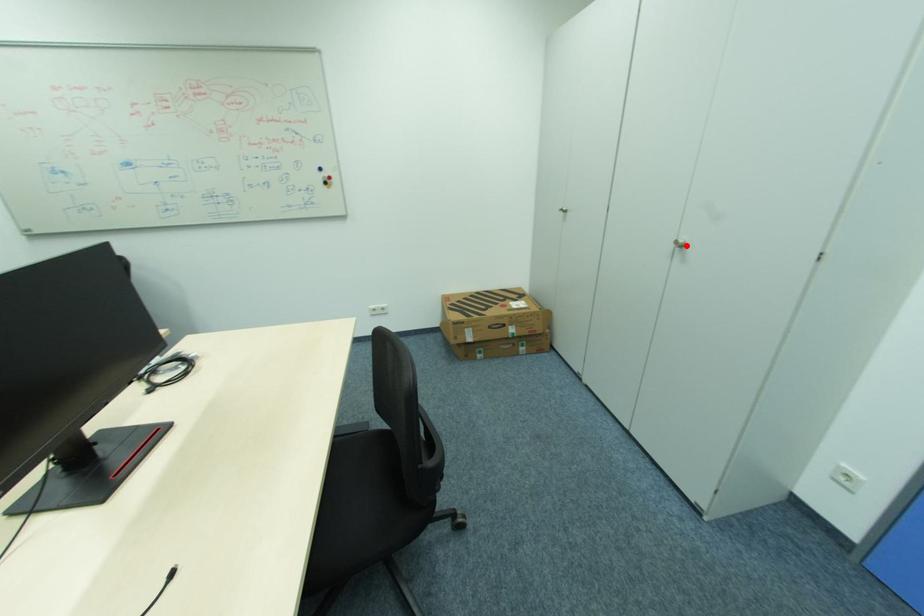
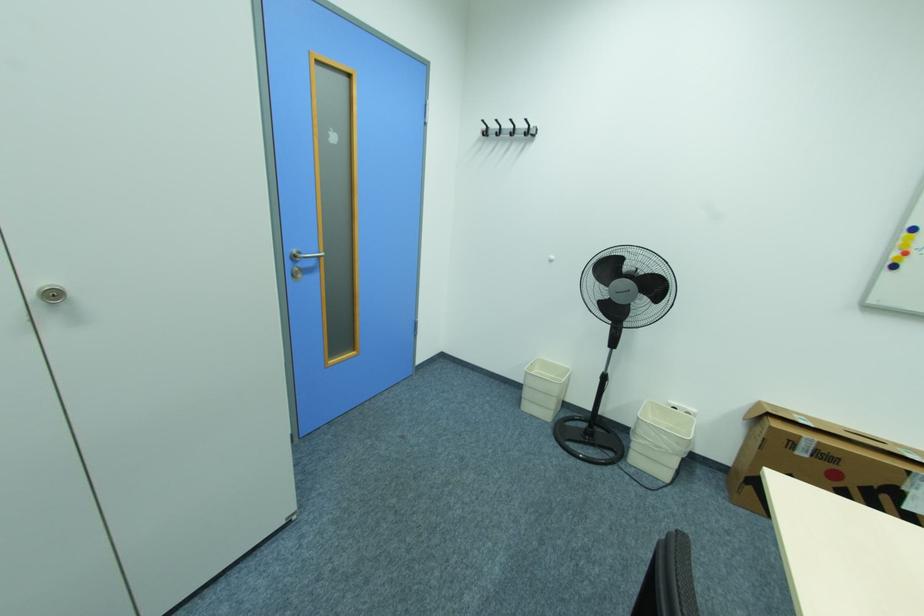
In the second image, find the point that corresponds to the highlighted location in the first image.

(64, 294)